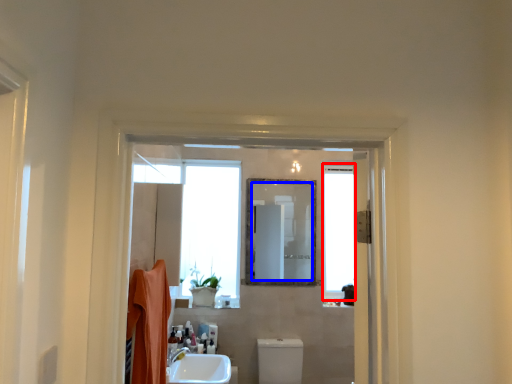
Question: Which of the following is the closest to the observer, window (highlighted by a red box) or mirror (highlighted by a blue box)?

Choices:
 (A) window
 (B) mirror

Answer: (B)